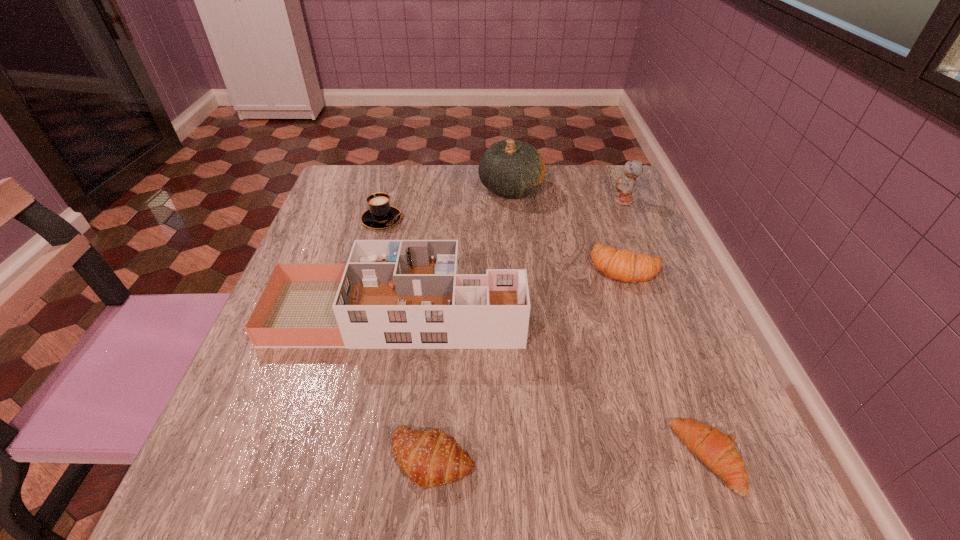
The height and width of the screenshot is (540, 960). Find the location of `dollhouse situated at the left edge`. dollhouse situated at the left edge is located at coordinates (394, 294).

I want to click on cappuccino that is at the left edge, so click(380, 214).

The width and height of the screenshot is (960, 540). What are the coordinates of `teddy bear that is at the right edge` in the screenshot? It's located at (625, 186).

This screenshot has height=540, width=960. Find the location of `object located at the far left corner`. object located at the far left corner is located at coordinates (380, 214).

This screenshot has width=960, height=540. Find the location of `object that is at the far right corner`. object that is at the far right corner is located at coordinates (625, 186).

Where is `object present at the near right corner`? The height and width of the screenshot is (540, 960). object present at the near right corner is located at coordinates (717, 450).

The width and height of the screenshot is (960, 540). I want to click on vacant space at the far edge, so click(x=420, y=207).

Where is `free spot at the near edge of the desktop`? free spot at the near edge of the desktop is located at coordinates (317, 476).

Locate an element on the screen. vacant space at the left edge is located at coordinates (323, 259).

At what (x,y) coordinates should I click in order to perform the action: click on vacant region at the right edge. Please return your answer as a coordinate pair (x, y). The image size is (960, 540). Looking at the image, I should click on (599, 218).